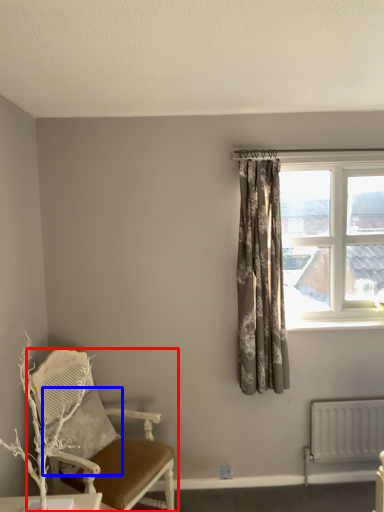
Question: Among these objects, which one is farthest to the camera, chair (highlighted by a red box) or pillow (highlighted by a blue box)?

Choices:
 (A) chair
 (B) pillow

Answer: (B)